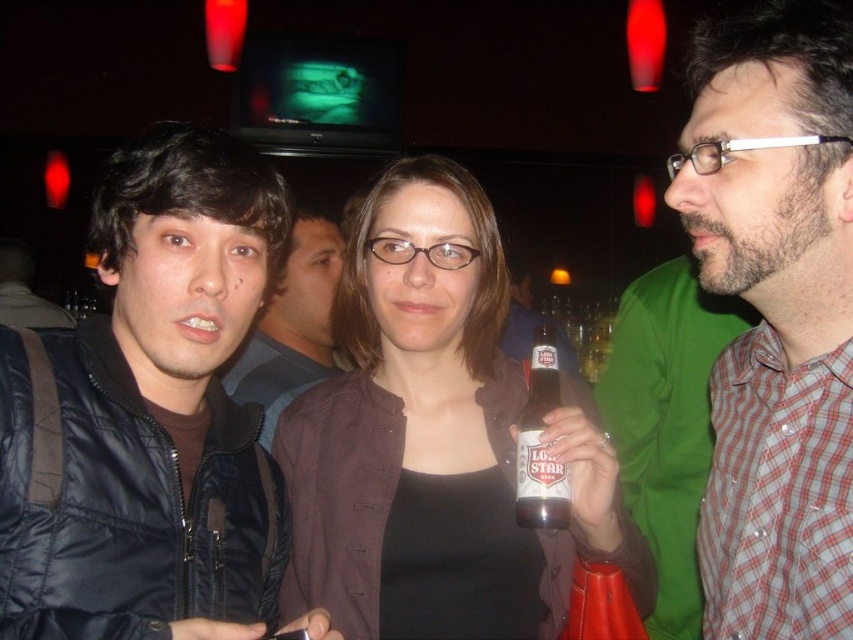
Question: Which object is farther from the camera taking this photo?

Choices:
 (A) plaid shirt at right
 (B) brown glass beer bottle at center

Answer: (B)

Question: Is black matte jacket at left bigger than brown matte jacket at center?

Choices:
 (A) yes
 (B) no

Answer: (B)

Question: Estimate the real-world distances between objects in this image. Which object is closer to the matte black jacket at center?

Choices:
 (A) black matte jacket at left
 (B) brown matte jacket at center
 (C) plaid shirt at right
 (D) brown glass beer bottle at center

Answer: (B)

Question: Can you confirm if black matte jacket at left is positioned below plaid shirt at right?

Choices:
 (A) no
 (B) yes

Answer: (B)

Question: Which object appears farthest from the camera in this image?

Choices:
 (A) black matte jacket at left
 (B) brown matte jacket at center

Answer: (B)

Question: From the image, what is the correct spatial relationship of brown matte jacket at center in relation to matte black jacket at center?

Choices:
 (A) above
 (B) below

Answer: (B)